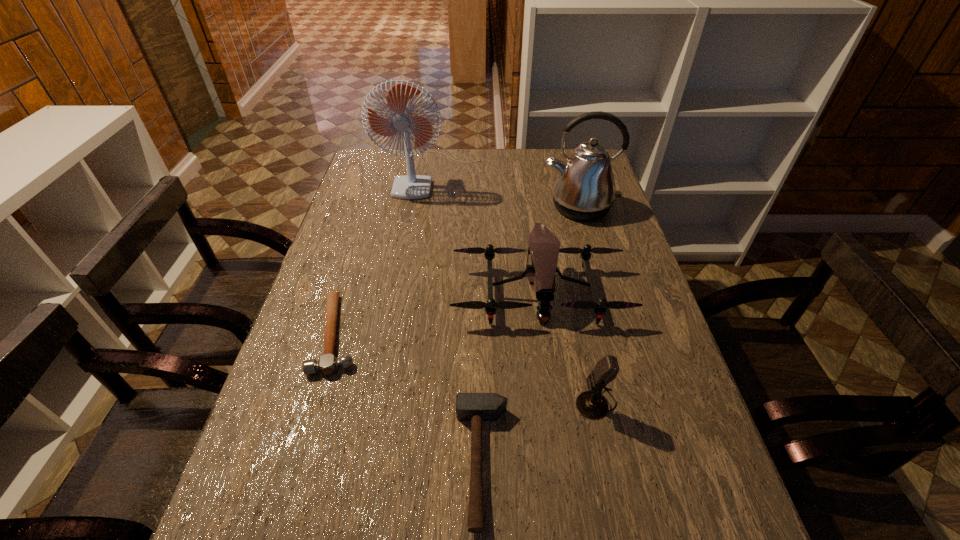
Identify the location of free region that satisfies the following two spatial constraints: 1. on the front-facing side of the tallest object; 2. on the left side of the kettle. The height and width of the screenshot is (540, 960). (427, 207).